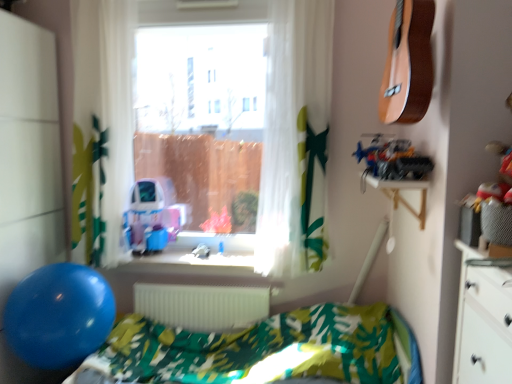
Question: Considering the relative sizes of metallic silver toy car at upper right and white/sheer curtain at left, the second curtain viewed from the right, in the image provided, is metallic silver toy car at upper right thinner than white/sheer curtain at left, the second curtain viewed from the right,?

Choices:
 (A) yes
 (B) no

Answer: (A)

Question: Would you say metallic silver toy car at upper right contains white/sheer curtain at left, the second curtain viewed from the right?

Choices:
 (A) yes
 (B) no

Answer: (B)

Question: From a real-world perspective, is metallic silver toy car at upper right over white/sheer curtain at left, which ranks as the first curtain in left-to-right order?

Choices:
 (A) no
 (B) yes

Answer: (A)

Question: Is the depth of metallic silver toy car at upper right greater than that of white/sheer curtain at left, which ranks as the first curtain in left-to-right order?

Choices:
 (A) no
 (B) yes

Answer: (A)

Question: Is metallic silver toy car at upper right at the left side of white/sheer curtain at left, the second curtain viewed from the right?

Choices:
 (A) yes
 (B) no

Answer: (B)

Question: Is metallic silver toy car at upper right not close to white/sheer curtain at left, the second curtain viewed from the right?

Choices:
 (A) no
 (B) yes

Answer: (B)

Question: Is metallic silver toy car at upper right smaller than light brown wood guitar at upper right?

Choices:
 (A) no
 (B) yes

Answer: (B)

Question: Is metallic silver toy car at upper right turned away from light brown wood guitar at upper right?

Choices:
 (A) no
 (B) yes

Answer: (A)

Question: Considering the relative sizes of metallic silver toy car at upper right and light brown wood guitar at upper right in the image provided, is metallic silver toy car at upper right shorter than light brown wood guitar at upper right?

Choices:
 (A) yes
 (B) no

Answer: (A)

Question: Can you confirm if metallic silver toy car at upper right is taller than light brown wood guitar at upper right?

Choices:
 (A) no
 (B) yes

Answer: (A)

Question: Considering the relative positions of metallic silver toy car at upper right and light brown wood guitar at upper right in the image provided, is metallic silver toy car at upper right behind light brown wood guitar at upper right?

Choices:
 (A) no
 (B) yes

Answer: (B)

Question: Is metallic silver toy car at upper right completely or partially outside of light brown wood guitar at upper right?

Choices:
 (A) yes
 (B) no

Answer: (A)

Question: Considering the relative sizes of translucent white curtain at center, the first curtain when ordered from right to left, and blue plastic toy at center in the image provided, is translucent white curtain at center, the first curtain when ordered from right to left, wider than blue plastic toy at center?

Choices:
 (A) yes
 (B) no

Answer: (B)